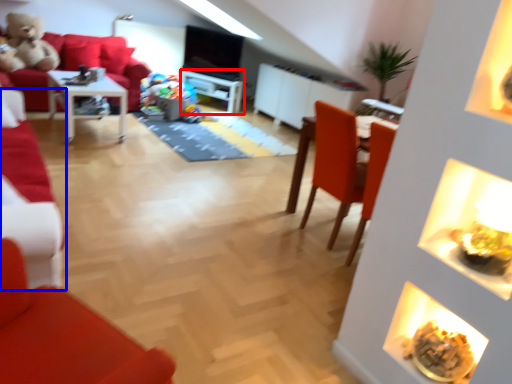
Question: Among these objects, which one is nearest to the camera, entertainment center (highlighted by a red box) or chair (highlighted by a blue box)?

Choices:
 (A) entertainment center
 (B) chair

Answer: (B)